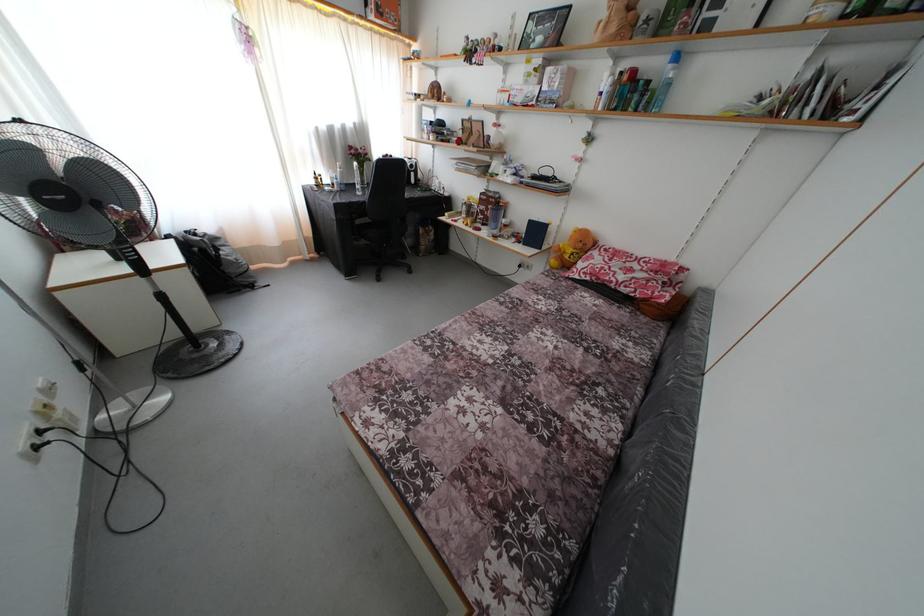
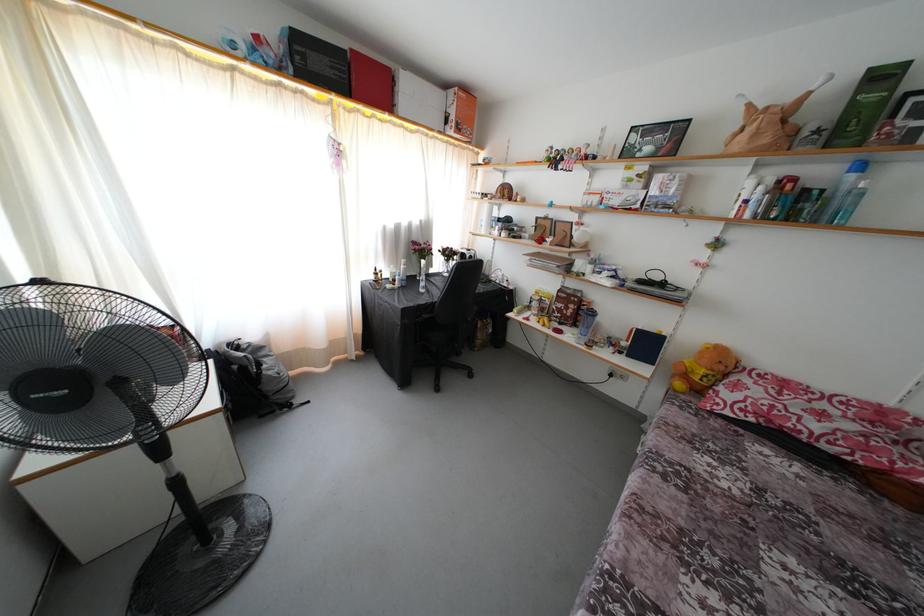
Find the pixel in the second image that matches pixel 245 286 in the first image.

(281, 403)